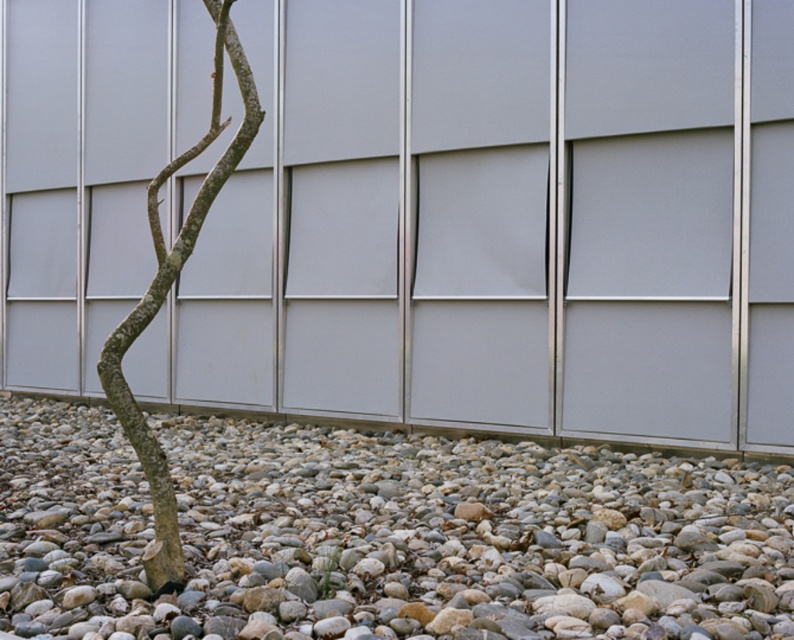
Question: Is smooth pebbles at lower center positioned before brown rough bark tree at lower left?

Choices:
 (A) no
 (B) yes

Answer: (A)

Question: Among these objects, which one is farthest from the camera?

Choices:
 (A) smooth pebbles at lower center
 (B) brown rough bark tree at lower left

Answer: (A)

Question: Which of the following is the farthest from the observer?

Choices:
 (A) (166, 614)
 (B) (110, 397)

Answer: (B)

Question: Does smooth pebbles at lower center have a greater width compared to brown rough bark tree at lower left?

Choices:
 (A) no
 (B) yes

Answer: (A)

Question: Does smooth pebbles at lower center appear on the right side of brown rough bark tree at lower left?

Choices:
 (A) no
 (B) yes

Answer: (A)